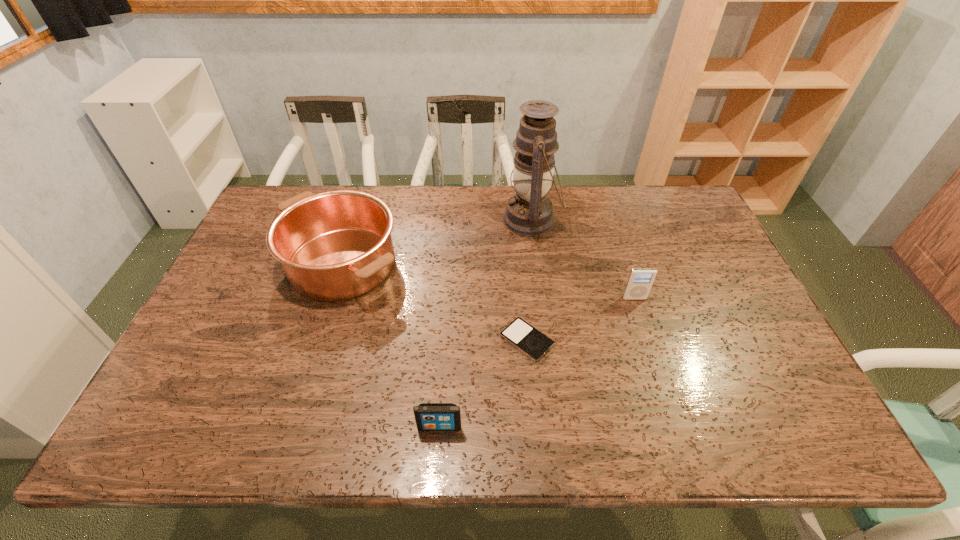
The width and height of the screenshot is (960, 540). In order to click on free space between the oil lamp and the second nearest object in this screenshot , I will do `click(529, 280)`.

Locate an element on the screen. empty space that is in between the second iPod from right to left and the leftmost iPod is located at coordinates (483, 383).

Identify which object is the fourth nearest to the third shortest object. Please provide its 2D coordinates. Your answer should be formatted as a tuple, i.e. [(x, y)], where the tuple contains the x and y coordinates of a point satisfying the conditions above.

[(336, 245)]

Identify the location of object that is the second closest one to the saucepan. Image resolution: width=960 pixels, height=540 pixels. (529, 212).

I want to click on iPod that is the second closest to the nearest object, so click(640, 280).

The image size is (960, 540). Find the location of `iPod that is the closest to the second iPod from left to right`. iPod that is the closest to the second iPod from left to right is located at coordinates [429, 416].